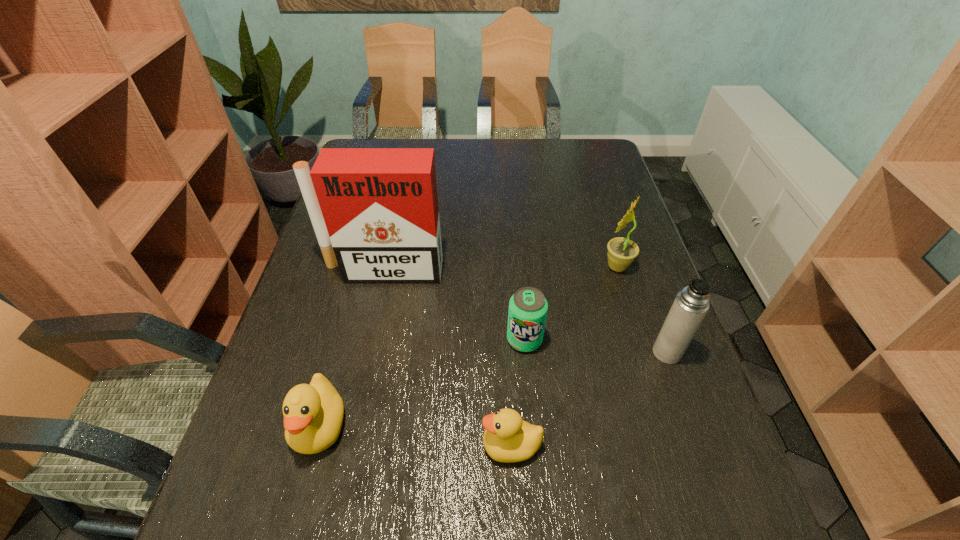
In order to click on free space located on the front-facing side of the pop soda in this screenshot , I will do `click(533, 436)`.

Find the location of `free space located 0.230m on the front-facing side of the tallest object`. free space located 0.230m on the front-facing side of the tallest object is located at coordinates (364, 359).

The image size is (960, 540). I want to click on vacant area situated 0.240m on the face of the sunflower, so click(513, 267).

Where is `blank area located on the face of the sunflower`? The width and height of the screenshot is (960, 540). blank area located on the face of the sunflower is located at coordinates (549, 267).

Where is `free space located on the face of the sunflower`? free space located on the face of the sunflower is located at coordinates (527, 267).

Locate an element on the screen. This screenshot has width=960, height=540. blank space located on the left of the thermos bottle is located at coordinates (564, 353).

Where is `duck that is at the left edge`? The width and height of the screenshot is (960, 540). duck that is at the left edge is located at coordinates (313, 413).

This screenshot has width=960, height=540. Find the location of `cigarette case at the left edge`. cigarette case at the left edge is located at coordinates (375, 213).

Find the location of a particular element. sunflower at the right edge is located at coordinates (621, 253).

Locate an element on the screen. The width and height of the screenshot is (960, 540). thermos bottle present at the right edge is located at coordinates (690, 306).